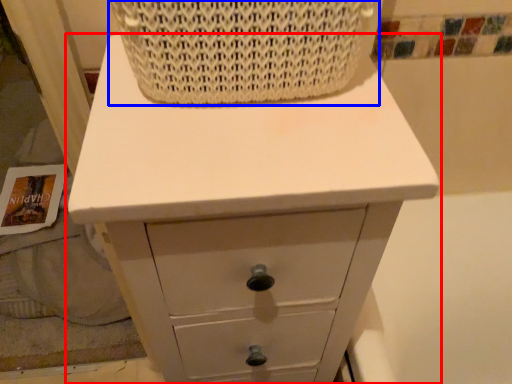
Question: Which object is closer to the camera taking this photo, chest of drawers (highlighted by a red box) or basket (highlighted by a blue box)?

Choices:
 (A) chest of drawers
 (B) basket

Answer: (B)